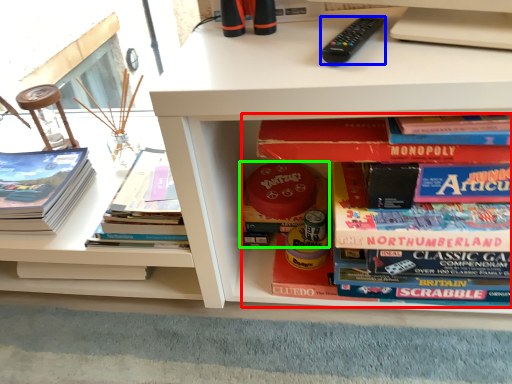
Question: Estimate the real-world distances between objects in this image. Which object is farther from book (highlighted by a red box), remote control (highlighted by a blue box) or book (highlighted by a green box)?

Choices:
 (A) remote control
 (B) book

Answer: (B)